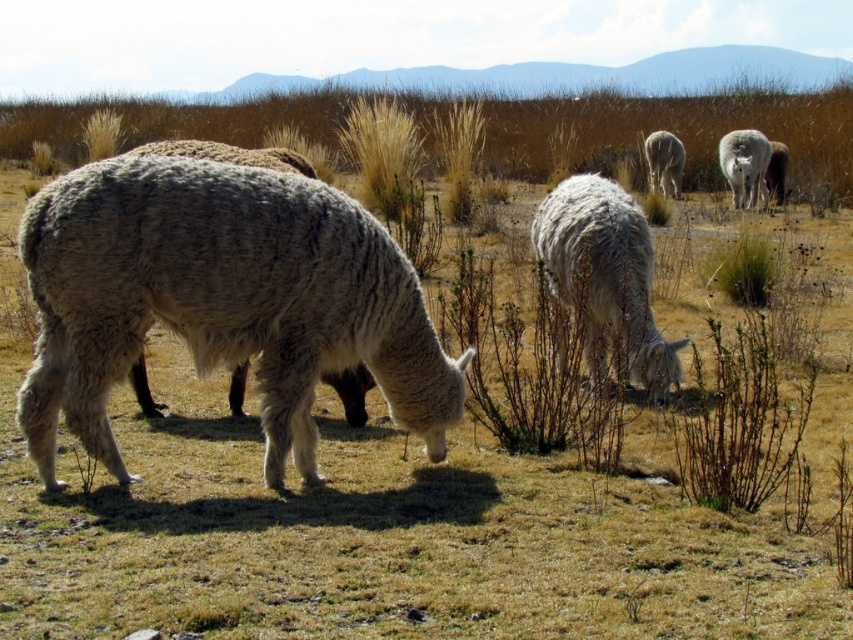
Question: Can you confirm if white woolen alpaca at upper right is smaller than white woolen sheep at center?

Choices:
 (A) yes
 (B) no

Answer: (B)

Question: Among these objects, which one is nearest to the camera?

Choices:
 (A) white woolen alpaca at upper right
 (B) white woolen alpaca at center
 (C) white woolen sheep at center
 (D) white woolen alpaca at left

Answer: (D)

Question: Among these points, which one is nearest to the camera?

Choices:
 (A) (648, 282)
 (B) (668, 157)
 (C) (730, 168)

Answer: (A)

Question: Does white woolen alpaca at center appear on the left side of white woolen sheep at center?

Choices:
 (A) yes
 (B) no

Answer: (A)

Question: Is white woolen alpaca at left further to the viewer compared to white woolen sheep at center?

Choices:
 (A) no
 (B) yes

Answer: (A)

Question: Among these points, which one is farthest from the camera?

Choices:
 (A) (668, 150)
 (B) (102, 176)
 (C) (764, 189)
 (D) (602, 298)

Answer: (A)